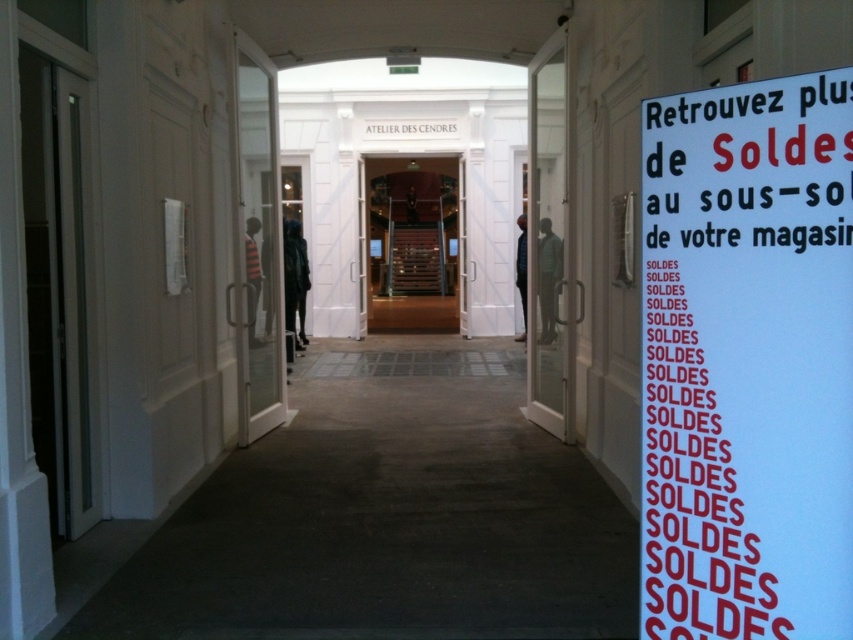
Can you confirm if transparent glass door at left is taller than wooden stairs at center?

In fact, transparent glass door at left may be shorter than wooden stairs at center.

Locate an element on the screen. This screenshot has width=853, height=640. transparent glass door at left is located at coordinates (257, 243).

Is clear glass door at center shorter than wooden stairs at center?

Yes, clear glass door at center is shorter than wooden stairs at center.

Is the position of clear glass door at center more distant than that of wooden stairs at center?

No, it is in front of wooden stairs at center.

Is point (556, 140) positioned in front of point (396, 196)?

Yes, it is in front of point (396, 196).

The width and height of the screenshot is (853, 640). Find the location of `clear glass door at center`. clear glass door at center is located at coordinates (548, 241).

Measure the distance from blue paper sign at right to transparent glass door at left.

The distance of blue paper sign at right from transparent glass door at left is 15.37 feet.

Is point (685, 433) closer to camera compared to point (239, 264)?

Yes, point (685, 433) is in front of point (239, 264).

Locate an element on the screen. blue paper sign at right is located at coordinates (747, 362).